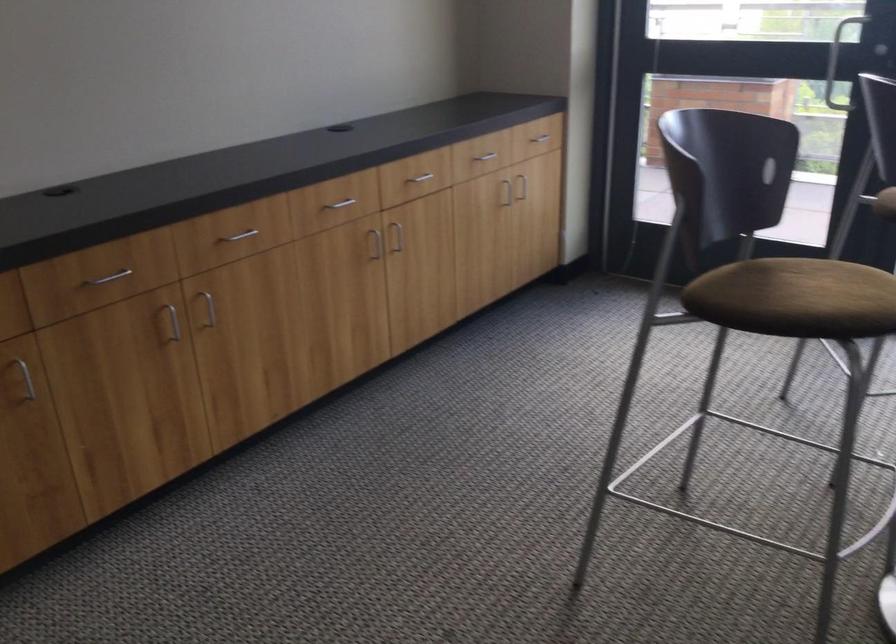
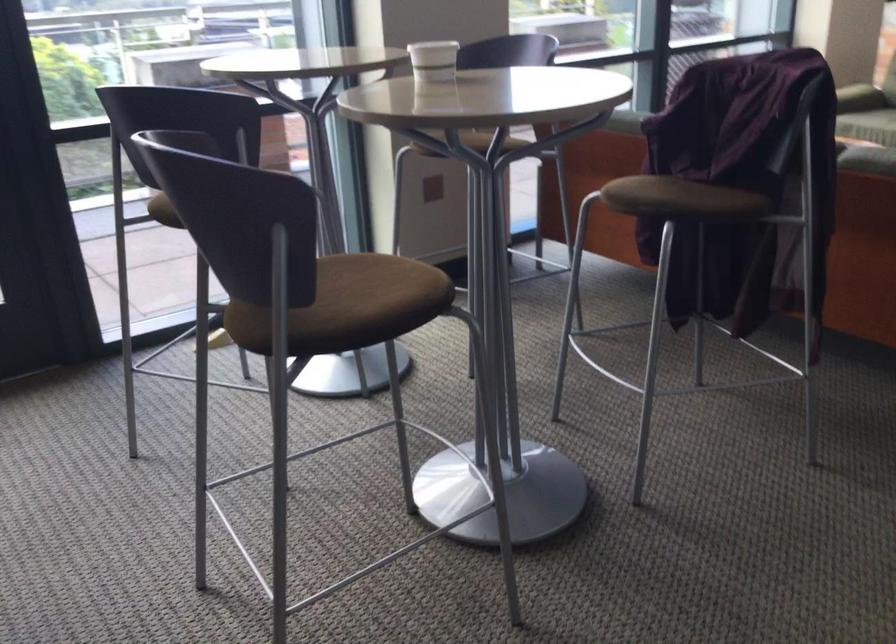
Question: The images are taken continuously from a first-person perspective. In which direction is your viewpoint rotating?

Choices:
 (A) Left
 (B) Right
 (C) Up
 (D) Down

Answer: (B)